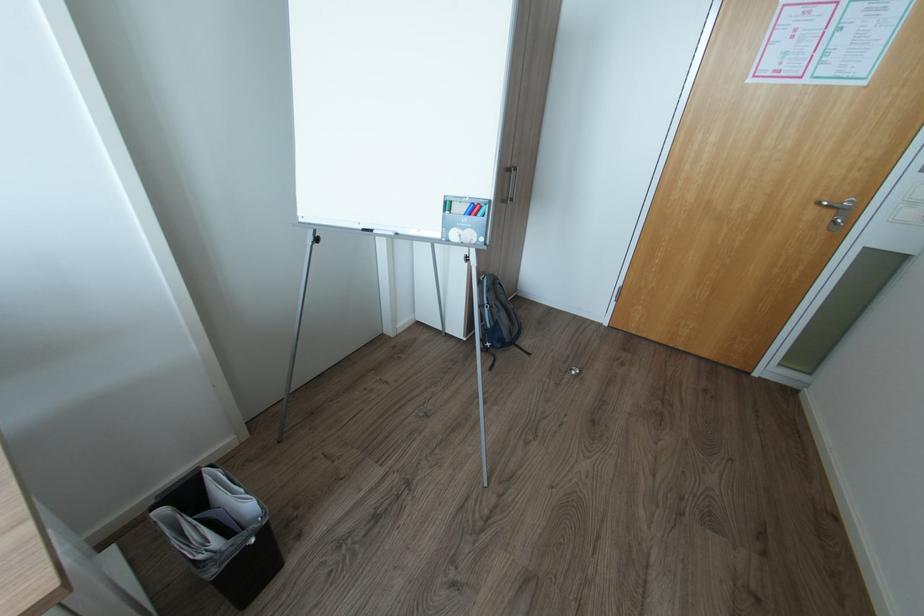
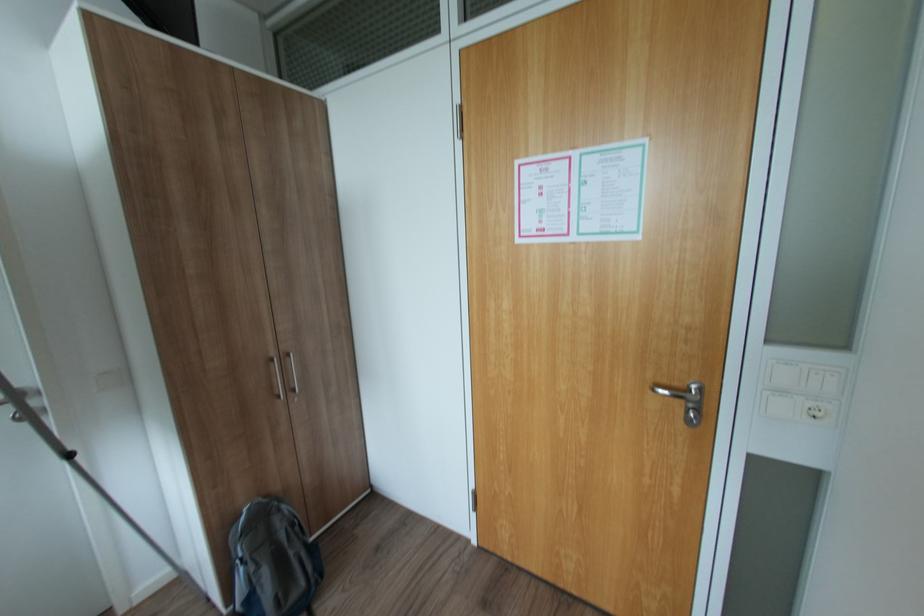
The point at (830, 204) is marked in the first image. Where is the corresponding point in the second image?

(664, 390)